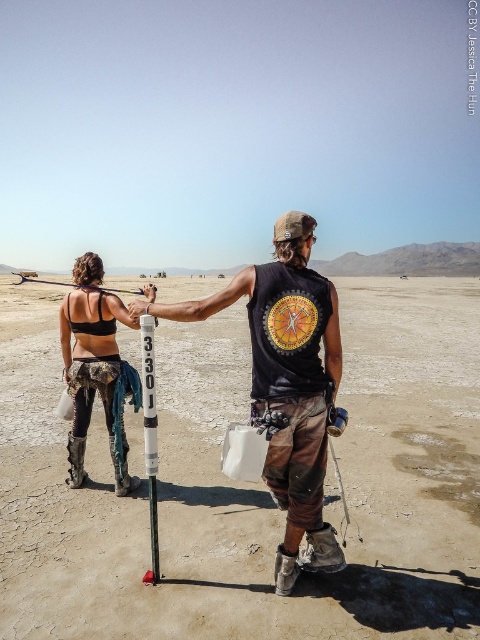
Can you confirm if black matte vest at center is positioned above matte black tank top at left?

No, black matte vest at center is not above matte black tank top at left.

Between black matte vest at center and matte black tank top at left, which one appears on the right side from the viewer's perspective?

black matte vest at center

Is point (169, 308) more distant than point (101, 305)?

No, (169, 308) is closer to viewer.

At what (x,y) coordinates should I click in order to perform the action: click on black matte vest at center. Please return your answer as a coordinate pair (x, y). This screenshot has width=480, height=640. Looking at the image, I should click on (288, 385).

Between dull brown dirt at center and matte black tank top at left, which one appears on the left side from the viewer's perspective?

From the viewer's perspective, matte black tank top at left appears more on the left side.

Between dull brown dirt at center and matte black tank top at left, which one has more height?

Standing taller between the two is dull brown dirt at center.

You are a GUI agent. You are given a task and a screenshot of the screen. Output one action in this format:
    pyautogui.click(x=<x>, y=<y>)
    Task: Click on the dull brown dirt at center
    The height and width of the screenshot is (640, 480).
    Given the screenshot: What is the action you would take?
    pyautogui.click(x=250, y=484)

Is dull brown dirt at center positioned in front of black matte vest at center?

No, dull brown dirt at center is further to the viewer.

Locate an element on the screen. The height and width of the screenshot is (640, 480). dull brown dirt at center is located at coordinates (250, 484).

Image resolution: width=480 pixels, height=640 pixels. What do you see at coordinates (250, 484) in the screenshot?
I see `dull brown dirt at center` at bounding box center [250, 484].

Image resolution: width=480 pixels, height=640 pixels. I want to click on dull brown dirt at center, so click(250, 484).